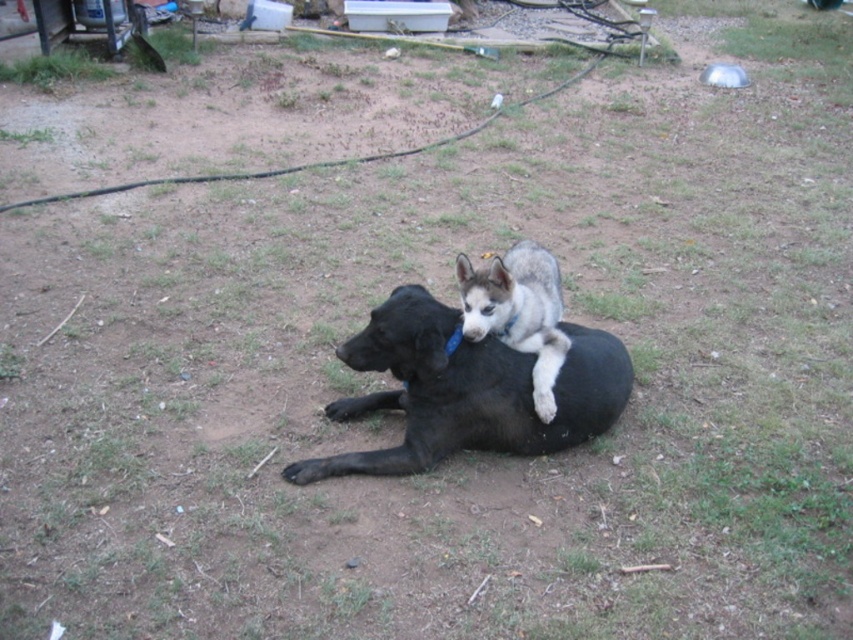
The width and height of the screenshot is (853, 640). What do you see at coordinates (467, 390) in the screenshot?
I see `black matte dog at center` at bounding box center [467, 390].

Who is higher up, black matte dog at center or gray fur dog at center?

gray fur dog at center

Between point (602, 376) and point (520, 256), which one is positioned in front?

Point (602, 376) is in front.

Find the location of a particular element. This screenshot has height=640, width=853. black matte dog at center is located at coordinates (467, 390).